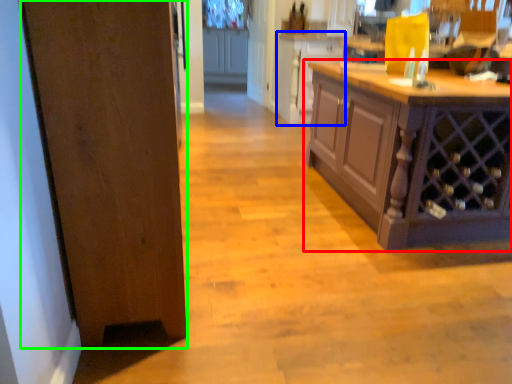
Question: Based on their relative distances, which object is farther from cabinetry (highlighted by a red box)? Choose from cabinetry (highlighted by a blue box) and door (highlighted by a green box).

Choices:
 (A) cabinetry
 (B) door

Answer: (A)